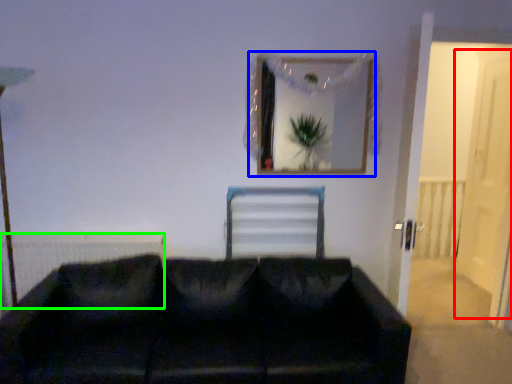
Question: Estimate the real-world distances between objects in this image. Which object is farther from glass door (highlighted by a red box), picture frame (highlighted by a blue box) or radiator (highlighted by a green box)?

Choices:
 (A) picture frame
 (B) radiator

Answer: (B)